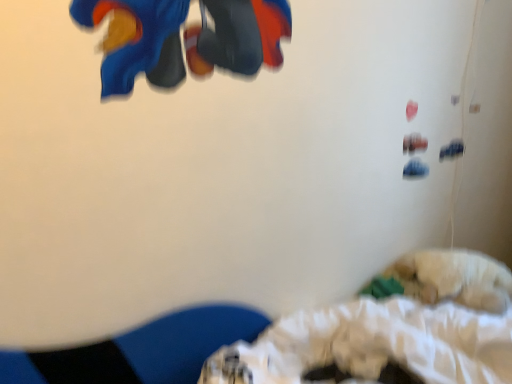
Identify the location of white fluffy dog at lower right. (390, 331).

Describe the element at coordinates (390, 331) in the screenshot. I see `white fluffy dog at lower right` at that location.

You are a GUI agent. You are given a task and a screenshot of the screen. Output one action in this format:
    pyautogui.click(x=<x>, y=<y>)
    Task: Click on the white fluffy dog at lower right
    This screenshot has height=384, width=512.
    Given the screenshot: What is the action you would take?
    pyautogui.click(x=390, y=331)